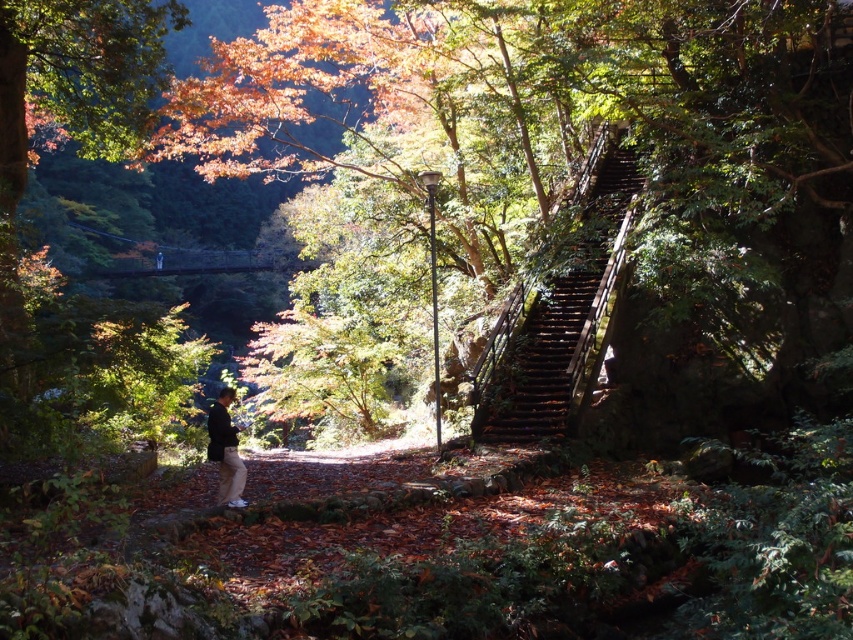
Between rusty wood stairs at right and dark brown leather jacket at lower center, which one appears on the left side from the viewer's perspective?

From the viewer's perspective, dark brown leather jacket at lower center appears more on the left side.

Between point (492, 426) and point (215, 406), which one is positioned in front?

Positioned in front is point (215, 406).

Image resolution: width=853 pixels, height=640 pixels. What are the coordinates of `rusty wood stairs at right` in the screenshot? It's located at click(564, 316).